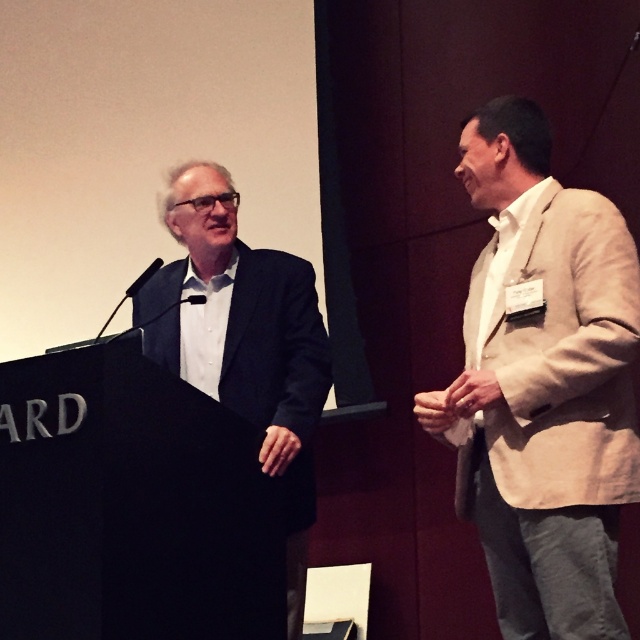
Does point (616, 378) come in front of point (307, 262)?

Yes, it is in front of point (307, 262).

Can you confirm if beige textured blazer at right is wider than dark blue suit at left?

Incorrect, beige textured blazer at right's width does not surpass dark blue suit at left's.

Measure the distance between beige textured blazer at right and camera.

The distance of beige textured blazer at right from camera is 7.02 feet.

Where is `beige textured blazer at right`? beige textured blazer at right is located at coordinates (544, 385).